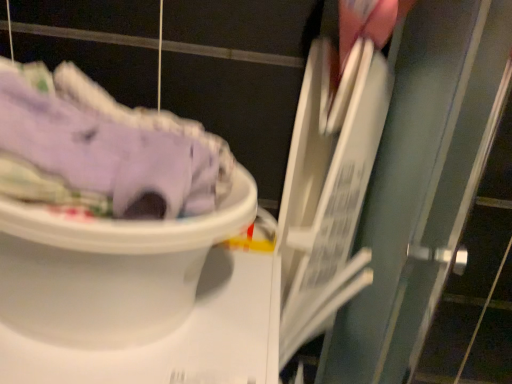
Locate an element on the screen. The height and width of the screenshot is (384, 512). white plastic toilet at lower left is located at coordinates (108, 269).

Image resolution: width=512 pixels, height=384 pixels. What do you see at coordinates (108, 269) in the screenshot?
I see `white plastic toilet at lower left` at bounding box center [108, 269].

Where is `purple cotton pants at left`? This screenshot has width=512, height=384. purple cotton pants at left is located at coordinates (103, 149).

What do you see at coordinates (103, 149) in the screenshot? Image resolution: width=512 pixels, height=384 pixels. I see `purple cotton pants at left` at bounding box center [103, 149].

Locate an element on the screen. The width and height of the screenshot is (512, 384). white plastic toilet at lower left is located at coordinates (108, 269).

Does white plastic toilet at lower left appear on the left side of purple cotton pants at left?

Indeed, white plastic toilet at lower left is positioned on the left side of purple cotton pants at left.

Considering their positions, is white plastic toilet at lower left located in front of or behind purple cotton pants at left?

Visually, white plastic toilet at lower left is located behind purple cotton pants at left.

Does point (151, 306) come closer to viewer compared to point (22, 72)?

Yes, it is in front of point (22, 72).

From the image's perspective, is white plastic toilet at lower left above or below purple cotton pants at left?

white plastic toilet at lower left is below purple cotton pants at left.

From a real-world perspective, does white plastic toilet at lower left stand above purple cotton pants at left?

Incorrect, from a real-world perspective, white plastic toilet at lower left is lower than purple cotton pants at left.

From the picture: Between white plastic toilet at lower left and purple cotton pants at left, which one has smaller width?

With smaller width is purple cotton pants at left.

Is white plastic toilet at lower left shorter than purple cotton pants at left?

No.

Based on their sizes in the image, would you say white plastic toilet at lower left is bigger or smaller than purple cotton pants at left?

white plastic toilet at lower left is bigger than purple cotton pants at left.

Is white plastic toilet at lower left outside of purple cotton pants at left?

Yes, white plastic toilet at lower left is located beyond the bounds of purple cotton pants at left.

From the picture: Is white plastic toilet at lower left next to purple cotton pants at left and touching it?

white plastic toilet at lower left is not next to purple cotton pants at left, and they're not touching.

Could you tell me if white plastic toilet at lower left is turned towards purple cotton pants at left?

No, white plastic toilet at lower left is not aimed at purple cotton pants at left.

Can you tell me how much white plastic toilet at lower left and purple cotton pants at left differ in facing direction?

The angle between the facing direction of white plastic toilet at lower left and the facing direction of purple cotton pants at left is 0.000371 degrees.

The width and height of the screenshot is (512, 384). Identify the location of clothing in front of the white plastic toilet at lower left. (103, 149).

Considering the positions of objects purple cotton pants at left and white plastic toilet at lower left in the image provided, who is more to the left, purple cotton pants at left or white plastic toilet at lower left?

white plastic toilet at lower left.

In the image, is purple cotton pants at left positioned in front of or behind white plastic toilet at lower left?

purple cotton pants at left is positioned closer to the viewer than white plastic toilet at lower left.

Is point (218, 138) closer or farther from the camera than point (104, 299)?

Clearly, point (218, 138) is more distant from the camera than point (104, 299).

From the image's perspective, which one is positioned higher, purple cotton pants at left or white plastic toilet at lower left?

From the image's view, purple cotton pants at left is above.

Based on the photo, from a real-world perspective, is purple cotton pants at left physically below white plastic toilet at lower left?

No, from a real-world perspective, purple cotton pants at left is not under white plastic toilet at lower left.

Does purple cotton pants at left have a lesser width compared to white plastic toilet at lower left?

Correct, the width of purple cotton pants at left is less than that of white plastic toilet at lower left.

Consider the image. Who is shorter, purple cotton pants at left or white plastic toilet at lower left?

→ purple cotton pants at left is shorter.

Which of these two, purple cotton pants at left or white plastic toilet at lower left, is smaller?

With smaller size is purple cotton pants at left.

Is white plastic toilet at lower left surrounded by purple cotton pants at left?

No, white plastic toilet at lower left is not a part of purple cotton pants at left.

Is purple cotton pants at left with white plastic toilet at lower left?

There is a gap between purple cotton pants at left and white plastic toilet at lower left.

Is purple cotton pants at left facing away from white plastic toilet at lower left?

No, purple cotton pants at left is not facing away from white plastic toilet at lower left.

What's the angular difference between purple cotton pants at left and white plastic toilet at lower left's facing directions?

The facing directions of purple cotton pants at left and white plastic toilet at lower left are 0.000371 degrees apart.

Find the location of a particular element. This screenshot has height=384, width=512. toilet behind the purple cotton pants at left is located at coordinates click(108, 269).

This screenshot has height=384, width=512. Identify the location of toilet on the left of purple cotton pants at left. click(108, 269).

You are a GUI agent. You are given a task and a screenshot of the screen. Output one action in this format:
    pyautogui.click(x=<x>, y=<y>)
    Task: Click on the toilet that appears below the purple cotton pants at left (from the image's perspective)
    The width and height of the screenshot is (512, 384).
    Given the screenshot: What is the action you would take?
    pyautogui.click(x=108, y=269)